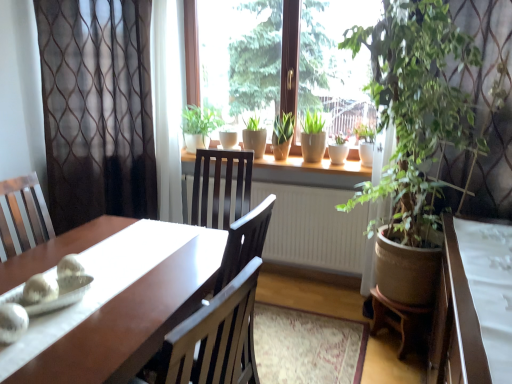
Measure the distance between point (345,166) and camera.

They are 2.95 meters apart.

At what (x,y) coordinates should I click in order to perform the action: click on green leafy plant at right, which is the 5th houseplant in left-to-right order. Please return your answer as a coordinate pair (x, y). The width and height of the screenshot is (512, 384). Looking at the image, I should click on (441, 100).

What do you see at coordinates (199, 126) in the screenshot?
I see `green matte plant at center, the first houseplant in the left-to-right sequence` at bounding box center [199, 126].

The height and width of the screenshot is (384, 512). What do you see at coordinates (473, 304) in the screenshot?
I see `white glossy table at lower right` at bounding box center [473, 304].

This screenshot has width=512, height=384. What are the coordinates of `green matte plant at window, positioned as the third houseplant in left-to-right order` in the screenshot? It's located at (313, 137).

Locate an element on the screen. The image size is (512, 384). white textured radiator at center is located at coordinates (313, 228).

At what (x,y) coordinates should I click in order to perform the action: click on smooth wooden window sill at center. Please return your answer as a coordinate pair (x, y). Looking at the image, I should click on (310, 171).

Considering the sizes of objects green matte plant at window, which ranks as the second houseplant in left-to-right order, and shiny brown desk at left in the image provided, who is smaller, green matte plant at window, which ranks as the second houseplant in left-to-right order, or shiny brown desk at left?

With smaller size is green matte plant at window, which ranks as the second houseplant in left-to-right order.

Considering the points (274, 133) and (158, 326), which point is behind, point (274, 133) or point (158, 326)?

Point (274, 133)

From a real-world perspective, which is physically below, green matte plant at window, which is the fourth houseplant in right-to-left order, or shiny brown desk at left?

shiny brown desk at left, from a real-world perspective.

From the image's perspective, would you say green matte plant at window, which ranks as the second houseplant in left-to-right order, is shown under green leafy plant at right, which is the 5th houseplant in left-to-right order?

Incorrect, from the image's perspective, green matte plant at window, which ranks as the second houseplant in left-to-right order, is higher than green leafy plant at right, which is the 5th houseplant in left-to-right order.

Does green matte plant at window, which is the fourth houseplant in right-to-left order, appear on the left side of green leafy plant at right, which is the 5th houseplant in left-to-right order?

Yes.

Considering the positions of points (287, 152) and (403, 201), is point (287, 152) farther from camera compared to point (403, 201)?

Yes, it is.

Is green matte plant at window, which is the fourth houseplant in right-to-left order, beside green leafy plant at right, which is the 5th houseplant in left-to-right order?

No.

From the image's perspective, between green matte plant at center, the first houseplant in the left-to-right sequence, and white glossy table at lower right, who is located below?

From the image's view, white glossy table at lower right is below.

Is green matte plant at center, the first houseplant in the left-to-right sequence, at the left side of white glossy table at lower right?

Yes.

From the picture: Considering the relative positions of green matte plant at center, the first houseplant in the left-to-right sequence, and white glossy table at lower right in the image provided, is green matte plant at center, the first houseplant in the left-to-right sequence, behind white glossy table at lower right?

Yes.

Could you tell me if green matte plant at center, the fifth houseplant in the right-to-left sequence, is turned towards white glossy table at lower right?

No, green matte plant at center, the fifth houseplant in the right-to-left sequence, is not facing towards white glossy table at lower right.

Is green matte plant at window, the third houseplant when ordered from right to left, turned away from sheer brown curtain at left, the 1th curtain positioned from the left?

No, green matte plant at window, the third houseplant when ordered from right to left, is not facing away from sheer brown curtain at left, the 1th curtain positioned from the left.

Which is more to the left, green matte plant at window, the third houseplant when ordered from right to left, or sheer brown curtain at left, the second curtain from the right?

sheer brown curtain at left, the second curtain from the right.

Considering the sizes of objects green matte plant at window, positioned as the third houseplant in left-to-right order, and sheer brown curtain at left, the second curtain from the right, in the image provided, who is wider, green matte plant at window, positioned as the third houseplant in left-to-right order, or sheer brown curtain at left, the second curtain from the right,?

With larger width is sheer brown curtain at left, the second curtain from the right.

Is green matte plant at window, the third houseplant when ordered from right to left, beside sheer brown curtain at left, the 1th curtain positioned from the left?

No, green matte plant at window, the third houseplant when ordered from right to left, is not beside sheer brown curtain at left, the 1th curtain positioned from the left.

Consider the image. Considering the relative sizes of smooth wooden window sill at center and green matte plant at window, positioned as the third houseplant in left-to-right order, in the image provided, is smooth wooden window sill at center thinner than green matte plant at window, positioned as the third houseplant in left-to-right order,?

No, smooth wooden window sill at center is not thinner than green matte plant at window, positioned as the third houseplant in left-to-right order.

Considering the positions of objects smooth wooden window sill at center and green matte plant at window, the third houseplant when ordered from right to left, in the image provided, who is more to the right, smooth wooden window sill at center or green matte plant at window, the third houseplant when ordered from right to left,?

green matte plant at window, the third houseplant when ordered from right to left, is more to the right.

Is green matte plant at window, the third houseplant when ordered from right to left, completely or partially inside smooth wooden window sill at center?

Definitely not — green matte plant at window, the third houseplant when ordered from right to left, is not inside smooth wooden window sill at center.

From the image's perspective, does smooth wooden window sill at center appear higher than green matte plant at window, positioned as the third houseplant in left-to-right order?

Incorrect, from the image's perspective, smooth wooden window sill at center is lower than green matte plant at window, positioned as the third houseplant in left-to-right order.

From the image's perspective, between green matte pot at center, placed as the 4th houseplant when sorted from left to right, and green matte plant at window, the third houseplant when ordered from right to left, which one is located above?

green matte plant at window, the third houseplant when ordered from right to left.

Is green matte pot at center, placed as the 4th houseplant when sorted from left to right, directly adjacent to green matte plant at window, the third houseplant when ordered from right to left?

No, green matte pot at center, placed as the 4th houseplant when sorted from left to right, is not beside green matte plant at window, the third houseplant when ordered from right to left.

From a real-world perspective, which is physically above, shiny brown desk at left or smooth wooden window sill at center?

In real-world perspective, smooth wooden window sill at center is above.

Is shiny brown desk at left turned away from smooth wooden window sill at center?

Yes, smooth wooden window sill at center is at the back of shiny brown desk at left.

How many degrees apart are the facing directions of shiny brown desk at left and smooth wooden window sill at center?

0.715 degrees.

From the image's perspective, is shiny brown desk at left located beneath smooth wooden window sill at center?

Yes, from the image's perspective, shiny brown desk at left is beneath smooth wooden window sill at center.

Identify the location of desk that appears below the green matte plant at window, which ranks as the second houseplant in left-to-right order (from the image's perspective). The image size is (512, 384). (113, 300).

This screenshot has width=512, height=384. There is a green leafy plant at right, which is the 5th houseplant in left-to-right order. Identify the location of the 3rd houseplant above it (from the image's perspective). (283, 135).

Considering their positions, is green leafy plant at right, which is the 5th houseplant in left-to-right order, positioned closer to green matte plant at center, the first houseplant in the left-to-right sequence, than green matte plant at window, positioned as the third houseplant in left-to-right order?

green matte plant at window, positioned as the third houseplant in left-to-right order, lies closer to green matte plant at center, the first houseplant in the left-to-right sequence, than the other object.

Considering their positions, is smooth wooden window sill at center positioned further to sheer brown curtain at upper left, which appears as the first curtain when viewed from the right, than green matte plant at window, the third houseplant when ordered from right to left?

green matte plant at window, the third houseplant when ordered from right to left, is positioned further to the anchor sheer brown curtain at upper left, which appears as the first curtain when viewed from the right.

When comparing their distances from green leafy plant at right, which is the 5th houseplant in left-to-right order, does shiny brown desk at left or white textured radiator at center seem further?

Among the two, shiny brown desk at left is located further to green leafy plant at right, which is the 5th houseplant in left-to-right order.

Based on their spatial positions, is sheer brown curtain at left, the second curtain from the right, or sheer brown curtain at upper left, positioned as the second curtain in left-to-right order, further from white glossy table at lower right?

The object further to white glossy table at lower right is sheer brown curtain at left, the second curtain from the right.

Based on their spatial positions, is white textured radiator at center or green leafy plant at right, which is the 5th houseplant in left-to-right order, closer to green matte plant at window, which ranks as the second houseplant in left-to-right order?

The object closer to green matte plant at window, which ranks as the second houseplant in left-to-right order, is white textured radiator at center.

Based on the photo, looking at the image, which one is located further to green matte plant at window, which ranks as the second houseplant in left-to-right order, green matte plant at center, the fifth houseplant in the right-to-left sequence, or white glossy table at lower right?

white glossy table at lower right.

Looking at the image, which one is located closer to white glossy table at lower right, green matte plant at center, the fifth houseplant in the right-to-left sequence, or sheer brown curtain at left, the 1th curtain positioned from the left?

green matte plant at center, the fifth houseplant in the right-to-left sequence.

Based on their spatial positions, is green matte plant at center, the first houseplant in the left-to-right sequence, or green matte pot at center, placed as the 4th houseplant when sorted from left to right, further from white glossy table at lower right?

green matte plant at center, the first houseplant in the left-to-right sequence.

Identify the location of window sill situated between green matte plant at center, the first houseplant in the left-to-right sequence, and green matte plant at window, the third houseplant when ordered from right to left, from left to right. The image size is (512, 384). (310, 171).

This screenshot has height=384, width=512. What are the coordinates of `window sill between shiny brown desk at left and sheer brown curtain at upper left, positioned as the second curtain in left-to-right order, from front to back` in the screenshot? It's located at (310, 171).

Where is `radiator located between sheer brown curtain at upper left, positioned as the second curtain in left-to-right order, and green matte plant at window, which is the fourth houseplant in right-to-left order, in the left-right direction`? radiator located between sheer brown curtain at upper left, positioned as the second curtain in left-to-right order, and green matte plant at window, which is the fourth houseplant in right-to-left order, in the left-right direction is located at coordinates (313, 228).

The width and height of the screenshot is (512, 384). Identify the location of radiator between green matte plant at center, the first houseplant in the left-to-right sequence, and green matte pot at center, the second houseplant from the right. (313, 228).